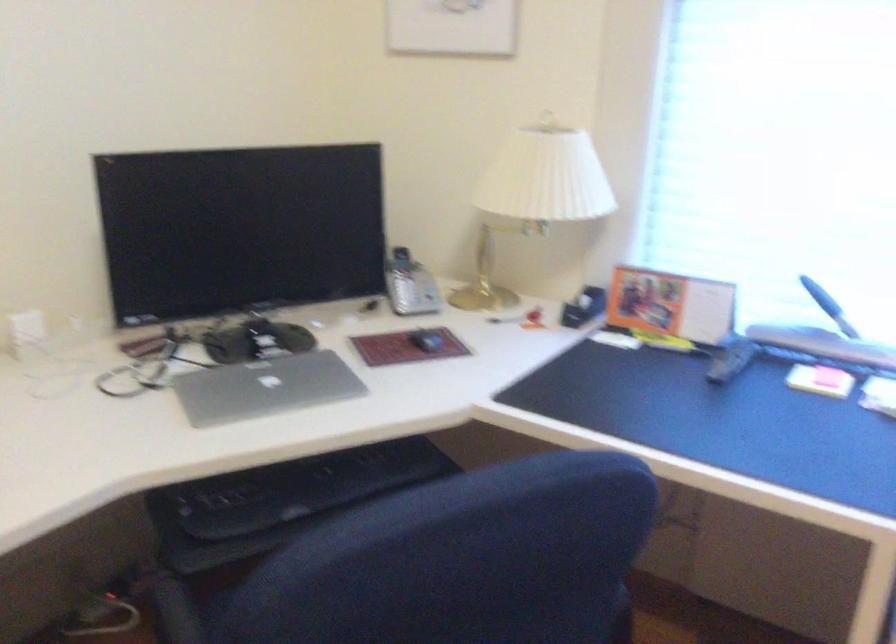
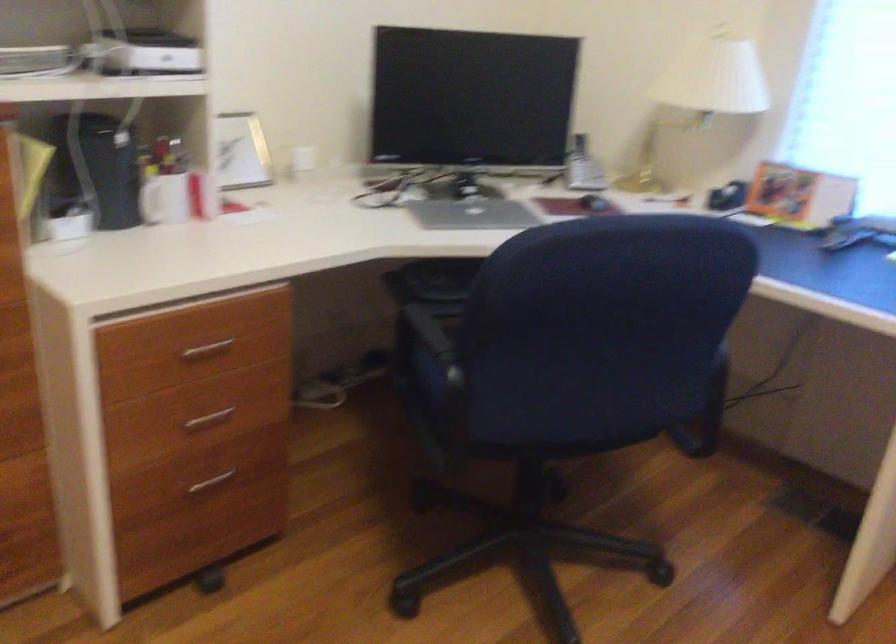
Question: Which direction would the cameraman need to move to produce the second image? Reply with the corresponding letter.

Choices:
 (A) Left
 (B) Right
 (C) Forward
 (D) Backward

Answer: (D)